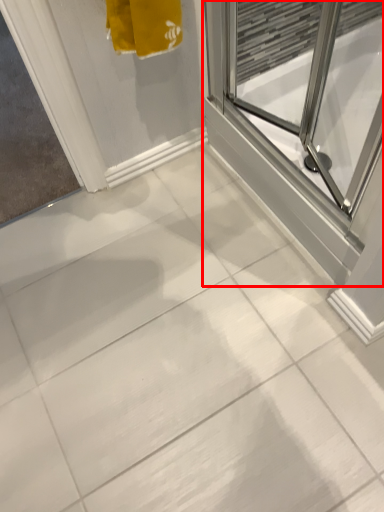
Question: From the image, what is the correct spatial relationship of screen door (annotated by the red box) in relation to window screen?

Choices:
 (A) right
 (B) left

Answer: (A)